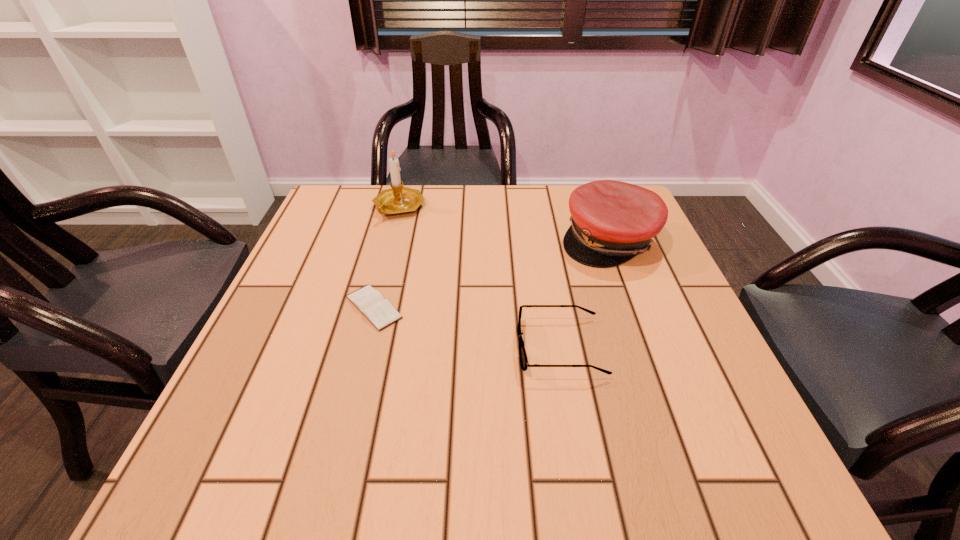
Identify the location of candle holder. (398, 200).

The width and height of the screenshot is (960, 540). I want to click on the third shortest object, so click(x=611, y=221).

I want to click on spectacles, so click(522, 352).

In order to click on diary in this screenshot , I will do `click(370, 302)`.

You are a GUI agent. You are given a task and a screenshot of the screen. Output one action in this format:
    pyautogui.click(x=<x>, y=<y>)
    Task: Click on the blank space located 0.340m on the right of the candle holder
    Image resolution: width=960 pixels, height=540 pixels.
    Given the screenshot: What is the action you would take?
    pyautogui.click(x=551, y=207)

You are a GUI agent. You are given a task and a screenshot of the screen. Output one action in this format:
    pyautogui.click(x=<x>, y=<y>)
    Task: Click on the free space located on the front-facing side of the cap
    This screenshot has height=540, width=960.
    Given the screenshot: What is the action you would take?
    pyautogui.click(x=638, y=320)

I want to click on vacant space located 0.180m on the front-facing side of the second shortest object, so click(421, 347).

Locate an element on the screen. blank space located 0.110m on the front-facing side of the second shortest object is located at coordinates (459, 347).

This screenshot has height=540, width=960. What are the coordinates of `free region located 0.290m on the front-facing side of the second shortest object` in the screenshot? It's located at (363, 347).

Find the location of `vacant space situated on the front of the diary`. vacant space situated on the front of the diary is located at coordinates (360, 361).